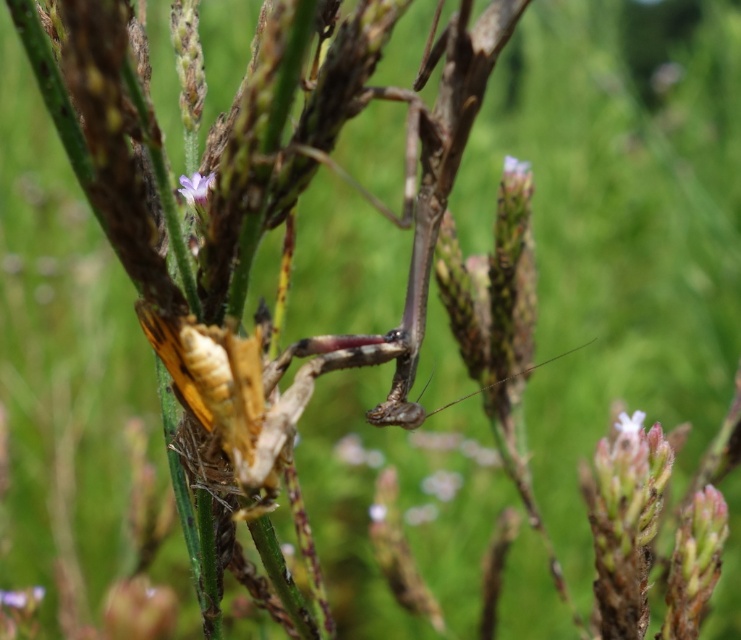
You are standing 1.5 meters away from the praying mantis in the image. If you move forward by 0.5 meters, will you be closer to the point at (210, 173) than the praying mantis?

The point at (210, 173) is 1.04 meters away from the viewer. After moving forward by 0.5 meters, the viewer is now 1.0 meters away from the praying mantis. Since 1.0 meters is less than 1.04 meters, the viewer will be closer to the praying mantis than the point at (210, 173).

You are a botanist examining two flowers on a plant stem. You have the purple matte flower at upper center and the smooth white flower at upper center in your view. Which flower do you think is bigger?

The purple matte flower at upper center is larger in size than the smooth white flower at upper center.

You are a botanist examining two flowers in the image. The purple matte flower at center and the smooth white flower at upper center. Which flower has a greater width?

The purple matte flower at center has a greater width than the smooth white flower at upper center.